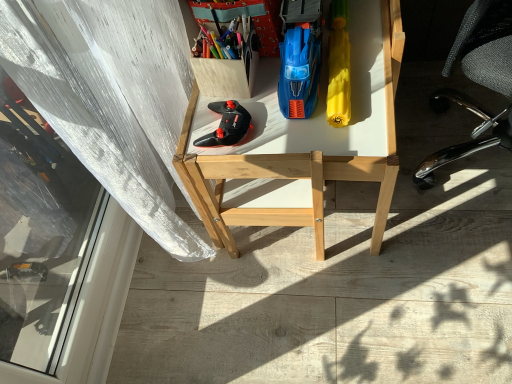
Where is `vacant space to the right of black matte controller at center`? vacant space to the right of black matte controller at center is located at coordinates (288, 114).